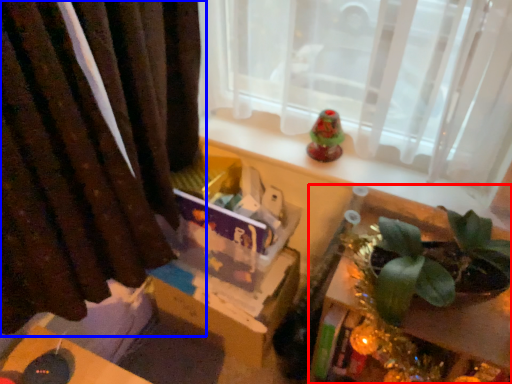
Question: Which object is closer to the camera taking this photo, table (highlighted by a red box) or curtain (highlighted by a blue box)?

Choices:
 (A) table
 (B) curtain

Answer: (B)